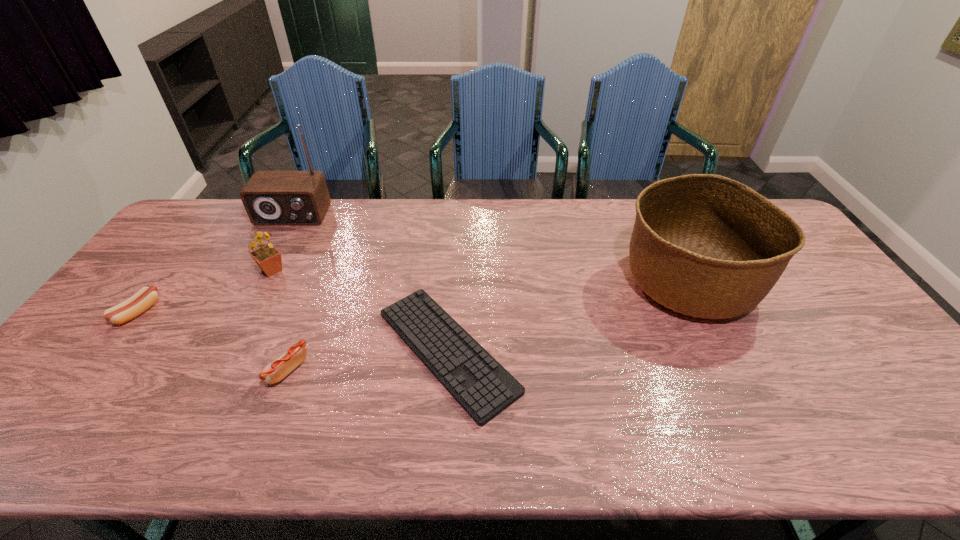
The width and height of the screenshot is (960, 540). I want to click on the shortest object, so click(x=477, y=381).

Image resolution: width=960 pixels, height=540 pixels. Identify the location of free space located 0.110m on the front-facing side of the tallest object. (276, 248).

Identify the location of vacant space situated 0.230m on the left of the basket. (542, 282).

Find the location of a particular element. This screenshot has height=540, width=960. vacant region located 0.210m at the front of the fourth shortest object with flowers visible is located at coordinates (355, 270).

You are a GUI agent. You are given a task and a screenshot of the screen. Output one action in this format:
    pyautogui.click(x=<x>, y=<y>)
    Task: Click on the vacant space located 0.100m on the front of the third object from right to left
    The height and width of the screenshot is (540, 960).
    Given the screenshot: What is the action you would take?
    (265, 429)

Where is `free region located on the front of the farther sausage`? The image size is (960, 540). free region located on the front of the farther sausage is located at coordinates (54, 422).

I want to click on vacant space situated on the back of the computer keyboard, so click(x=454, y=255).

Find the location of `object at the far edge`. object at the far edge is located at coordinates (270, 197).

This screenshot has width=960, height=540. In order to click on object that is at the near edge in this screenshot , I will do `click(477, 381)`.

The height and width of the screenshot is (540, 960). Find the location of `object that is at the left edge`. object that is at the left edge is located at coordinates (141, 301).